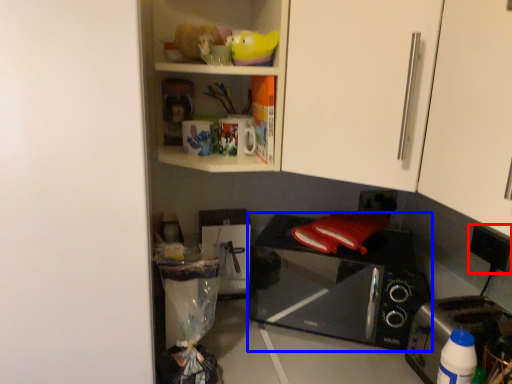
Question: Which object appears closest to the camera in this image, electric outlet (highlighted by a red box) or microwave oven (highlighted by a blue box)?

Choices:
 (A) electric outlet
 (B) microwave oven

Answer: (B)